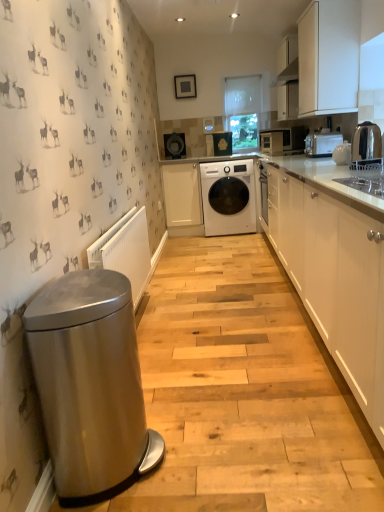
Identify the location of vacant area situated below white ceramic teapot at upper right, which is the 4th appliance in back-to-front order (from a real-world perspective). Image resolution: width=384 pixels, height=512 pixels. (340, 165).